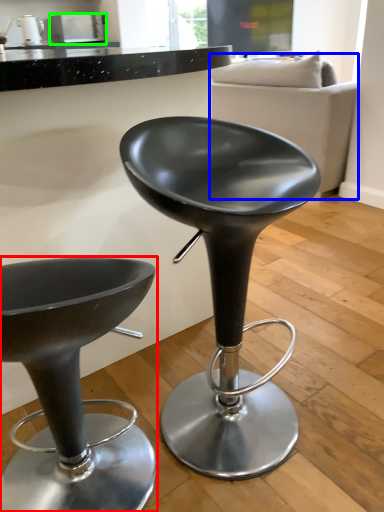
Question: Which object is positioned farthest from chair (highlighted by a red box)? Select from couch (highlighted by a blue box) and appliance (highlighted by a green box).

Choices:
 (A) couch
 (B) appliance

Answer: (B)